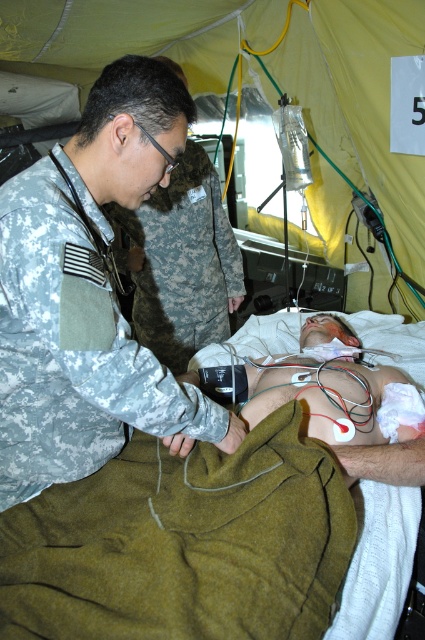
You are a medic in the field and need to quickly identify which staff member is closer to the patient. Based on the scene, which of the two individuals wearing a camouflage uniform at center or camo fabric uniform at upper left is closer to the patient?

The camouflage uniform at center is closer to the patient because they are attending to the patient directly, while the camo fabric uniform at upper left is positioned further away.

You are a drone operator controlling a drone that is positioned to capture images of the scene. You need to adjust the drone to focus on the point at coordinates point (88,19) and point (201,241). Which point is closer to the drone?

Point (88,19) is further to the camera than point (201,241), so the point (201,241) is closer to the drone.

You are a medical supply delivery person who needs to enter the tent. The entrance is narrow, and you must determine if your stretcher, which is as wide as the camouflage uniform at center, can fit through the entrance without damaging the matte green tent at center. Can it?

The camouflage uniform at center is narrower than the matte green tent at center, so the stretcher, being as wide as the camouflage uniform at center, can fit through the entrance without damaging the matte green tent at center.